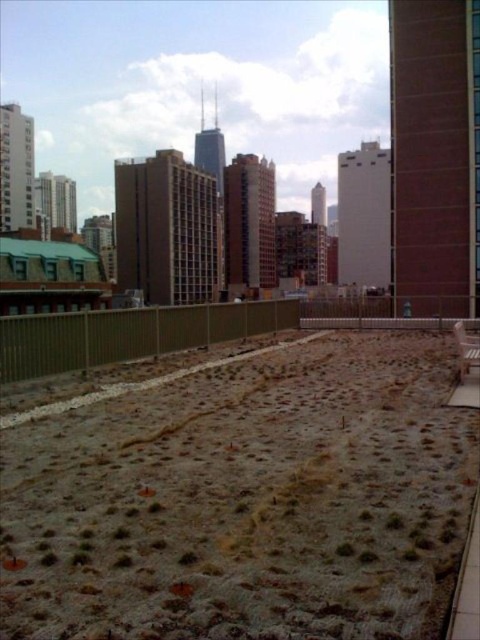
In the scene shown: Who is more distant from viewer, [476,364] or [338,545]?

The point [476,364] is more distant.

The width and height of the screenshot is (480, 640). Identify the location of wooden park bench at center. (466, 349).